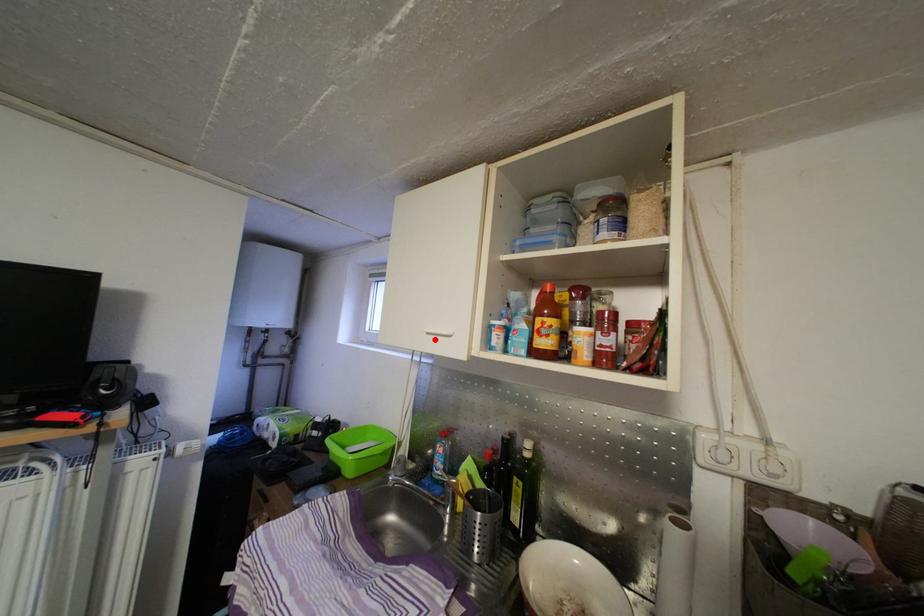
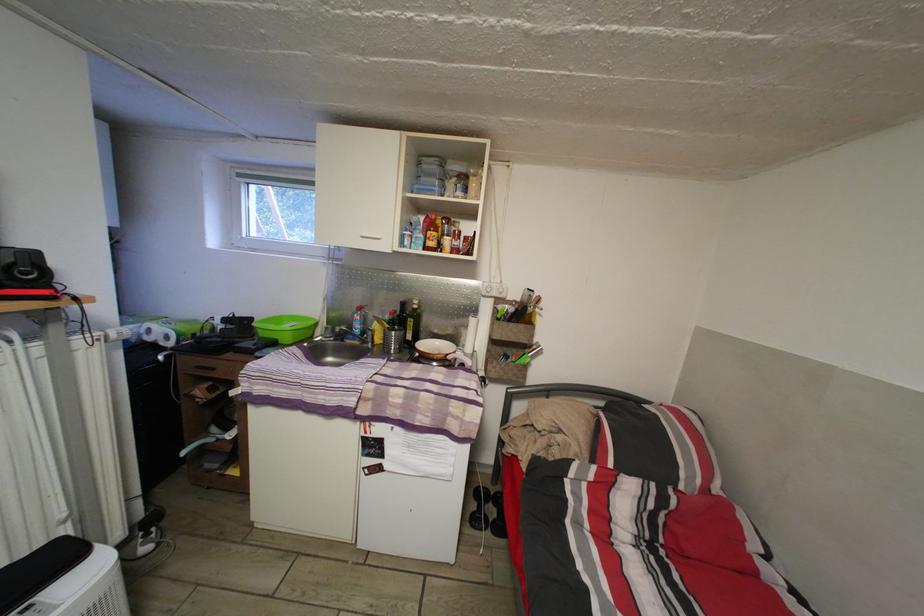
The point at the highlighted location is marked in the first image. Where is the corresponding point in the second image?

(370, 244)